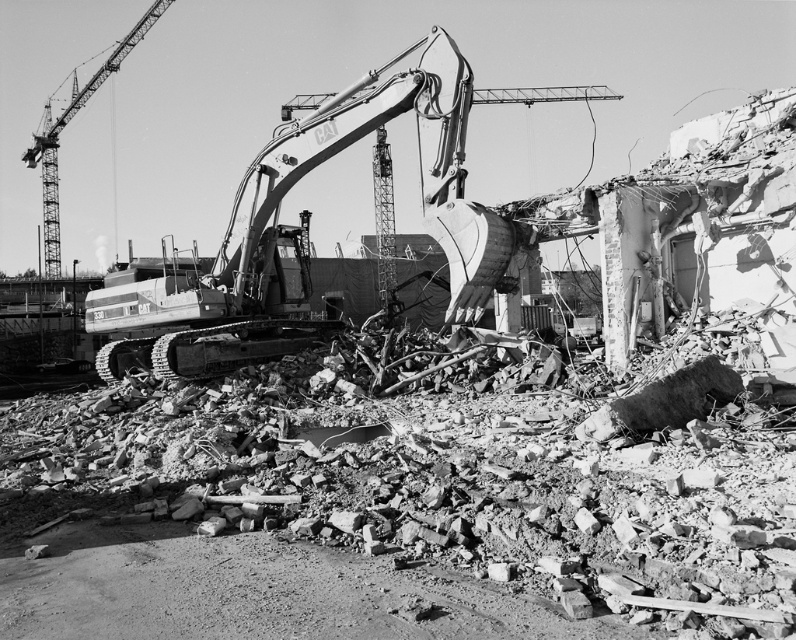
Is metallic gray excavator at center in front of metallic gray crane at upper left?

Yes, it is in front of metallic gray crane at upper left.

Is metallic gray excavator at center behind metallic gray crane at upper left?

That is False.

Between point (299, 150) and point (53, 170), which one is positioned in front?

Point (299, 150)

Where is `metallic gray excavator at center`? The height and width of the screenshot is (640, 796). metallic gray excavator at center is located at coordinates (281, 227).